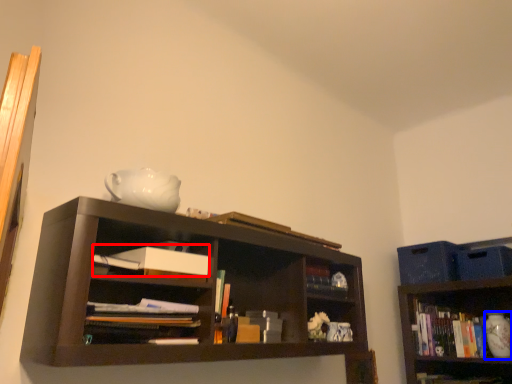
Question: Among these objects, which one is nearest to the camera, paperback book (highlighted by a red box) or glass vase (highlighted by a blue box)?

Choices:
 (A) paperback book
 (B) glass vase

Answer: (A)